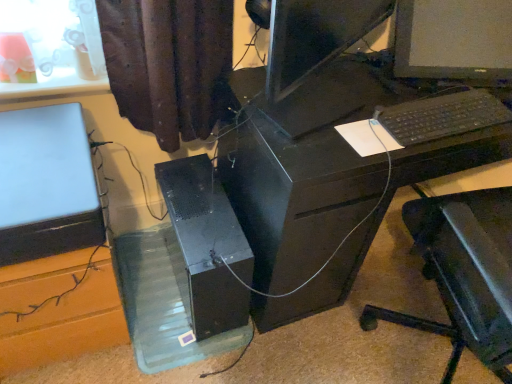
You are a GUI agent. You are given a task and a screenshot of the screen. Output one action in this format:
    pyautogui.click(x=<x>, y=<y>)
    Task: Click on the blank space above transparent plastic glass box at lower center (from a real-world perspective)
    
    Given the screenshot: What is the action you would take?
    pyautogui.click(x=157, y=291)